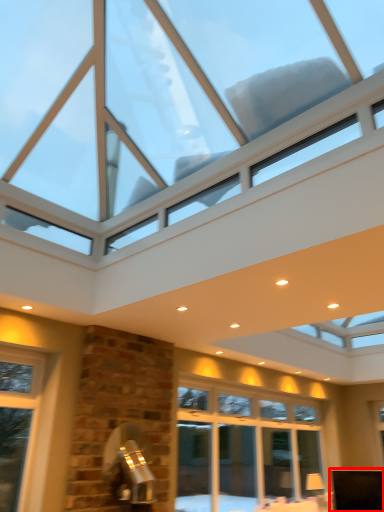
Question: Observing the image, what is the correct spatial positioning of furniture (annotated by the red box) in reference to window?

Choices:
 (A) right
 (B) left

Answer: (A)